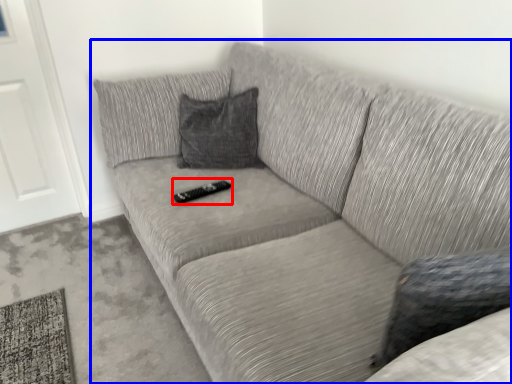
Question: Among these objects, which one is nearest to the camera, remote (highlighted by a red box) or studio couch (highlighted by a blue box)?

Choices:
 (A) remote
 (B) studio couch

Answer: (B)